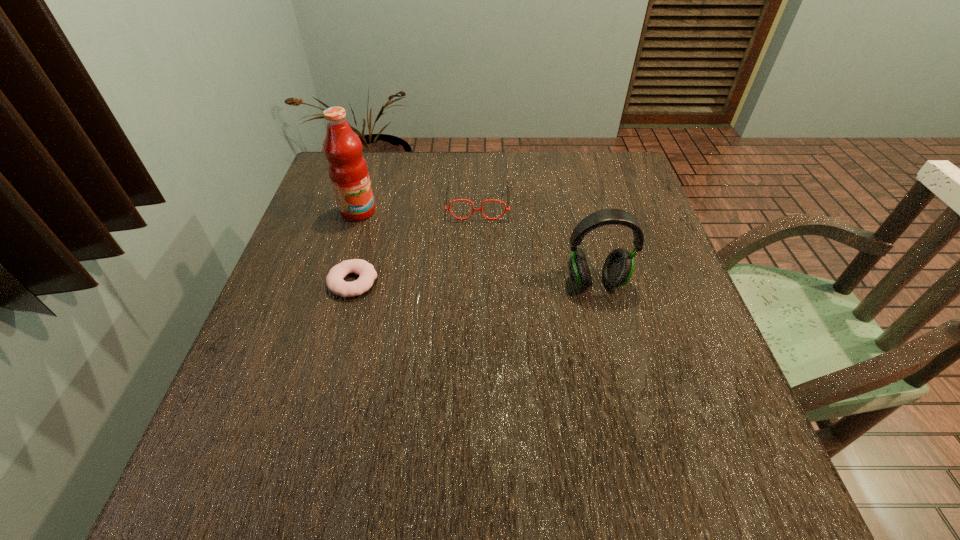
At what (x,y) coordinates should I click in order to perform the action: click on free space located 0.150m on the front label of the tallest object. Please return your answer as a coordinate pair (x, y). The width and height of the screenshot is (960, 540). Looking at the image, I should click on (415, 239).

Locate an element on the screen. The width and height of the screenshot is (960, 540). vacant space located on the front-facing side of the third tallest object is located at coordinates (475, 305).

Locate an element on the screen. This screenshot has height=540, width=960. vacant space situated on the front-facing side of the third tallest object is located at coordinates (474, 328).

Where is `vacant position located on the front-facing side of the third tallest object`? Image resolution: width=960 pixels, height=540 pixels. vacant position located on the front-facing side of the third tallest object is located at coordinates (474, 313).

You are a GUI agent. You are given a task and a screenshot of the screen. Output one action in this format:
    pyautogui.click(x=<x>, y=<y>)
    Task: Click on the object that is at the far edge
    The height and width of the screenshot is (540, 960).
    Given the screenshot: What is the action you would take?
    pyautogui.click(x=448, y=181)

Locate an element on the screen. This screenshot has width=960, height=540. doughnut that is at the left edge is located at coordinates (334, 280).

The height and width of the screenshot is (540, 960). In order to click on fruit juice present at the left edge in this screenshot , I will do coord(347,168).

Where is `object situated at the right edge`? object situated at the right edge is located at coordinates (618, 267).

At what (x,y) coordinates should I click in order to perform the action: click on free spot at the far edge of the desktop. Please return your answer as a coordinate pair (x, y). This screenshot has width=960, height=540. Looking at the image, I should click on (552, 189).

Image resolution: width=960 pixels, height=540 pixels. What are the coordinates of `vacant space at the near edge of the desktop` in the screenshot? It's located at (648, 424).